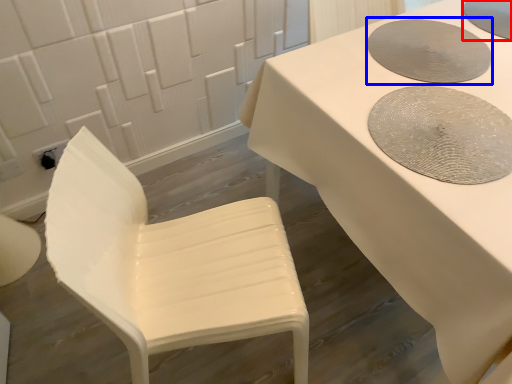
Question: Which object appears closest to the camera in this image, manhole cover (highlighted by a red box) or manhole cover (highlighted by a blue box)?

Choices:
 (A) manhole cover
 (B) manhole cover

Answer: (B)